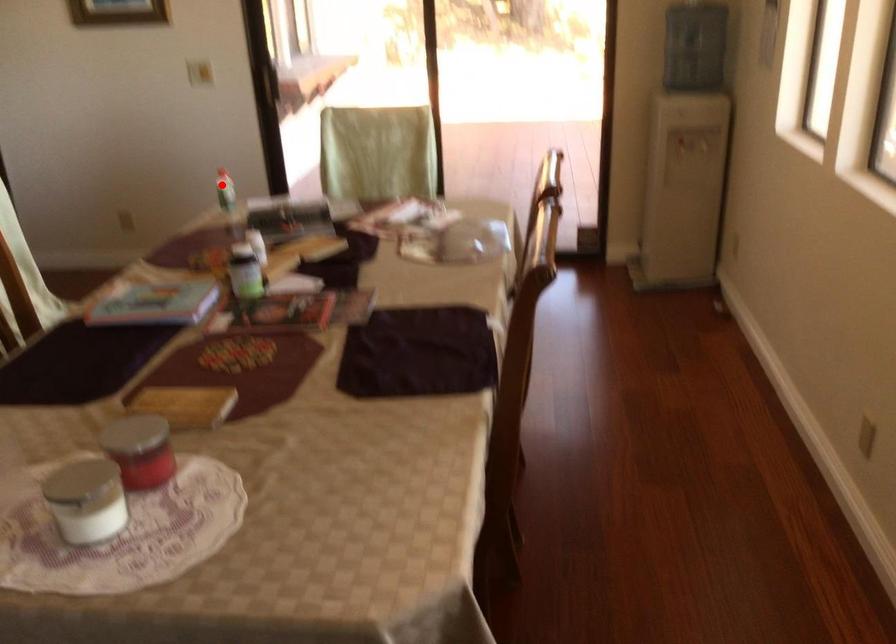
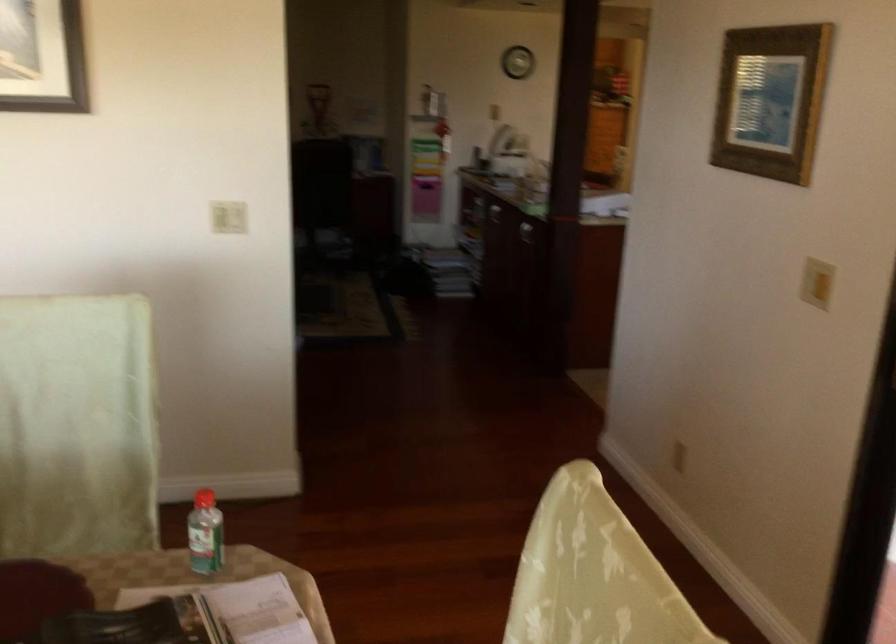
Locate, in the second image, the point that corresponds to the highlighted location in the first image.

(204, 534)